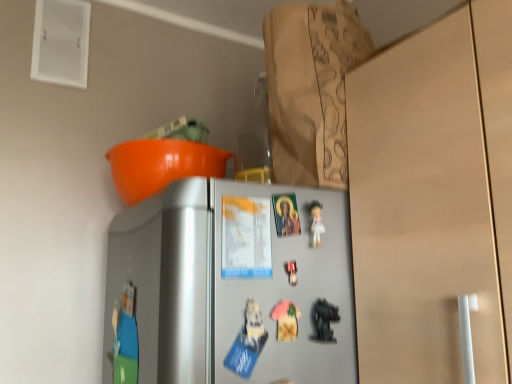
Question: Should I look upward or downward to see metallic silver fridge at center?

Choices:
 (A) up
 (B) down

Answer: (B)

Question: Is there a large distance between metallic silver fridge at center and pink fabric magnet at center, the first toy in the left-to-right sequence?

Choices:
 (A) yes
 (B) no

Answer: (B)

Question: Does metallic silver fridge at center have a greater height compared to pink fabric magnet at center, acting as the third toy starting from the right?

Choices:
 (A) yes
 (B) no

Answer: (A)

Question: From the image's perspective, is metallic silver fridge at center located beneath pink fabric magnet at center, the first toy in the left-to-right sequence?

Choices:
 (A) yes
 (B) no

Answer: (B)

Question: Considering the relative sizes of metallic silver fridge at center and pink fabric magnet at center, the first toy in the left-to-right sequence, in the image provided, is metallic silver fridge at center smaller than pink fabric magnet at center, the first toy in the left-to-right sequence,?

Choices:
 (A) no
 (B) yes

Answer: (A)

Question: From a real-world perspective, does metallic silver fridge at center sit lower than pink fabric magnet at center, the first toy in the left-to-right sequence?

Choices:
 (A) yes
 (B) no

Answer: (B)

Question: From a real-world perspective, is metallic silver fridge at center on top of pink fabric magnet at center, acting as the third toy starting from the right?

Choices:
 (A) yes
 (B) no

Answer: (A)

Question: Is metallic silver toy at center, the second toy from the left, inside brown paper bag at upper center?

Choices:
 (A) yes
 (B) no

Answer: (B)

Question: Is brown paper bag at upper center beside metallic silver toy at center, which is counted as the 2th toy, starting from the right?

Choices:
 (A) yes
 (B) no

Answer: (B)

Question: Can you confirm if brown paper bag at upper center is thinner than metallic silver toy at center, the second toy from the left?

Choices:
 (A) yes
 (B) no

Answer: (B)

Question: Can you confirm if brown paper bag at upper center is smaller than metallic silver toy at center, which is counted as the 2th toy, starting from the right?

Choices:
 (A) yes
 (B) no

Answer: (B)

Question: Is brown paper bag at upper center oriented away from metallic silver toy at center, the second toy from the left?

Choices:
 (A) yes
 (B) no

Answer: (B)

Question: Does brown paper bag at upper center have a larger size compared to metallic silver toy at center, which is counted as the 2th toy, starting from the right?

Choices:
 (A) yes
 (B) no

Answer: (A)

Question: Can you confirm if pink fabric magnet at center, acting as the third toy starting from the right, is taller than metallic silver toy at center, the second toy from the left?

Choices:
 (A) no
 (B) yes

Answer: (B)